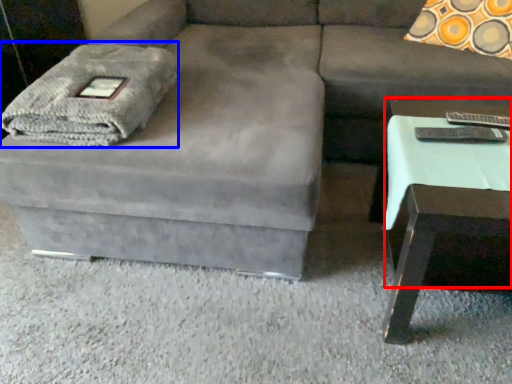
Question: Among these objects, which one is farthest to the camera, side table (highlighted by a red box) or blanket (highlighted by a blue box)?

Choices:
 (A) side table
 (B) blanket

Answer: (B)